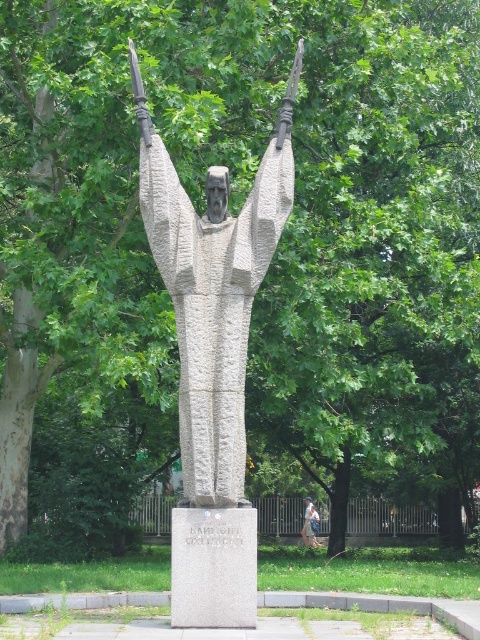
You are a photographer standing in the park. You want to take a photo of the gray stone statue at center and the light blue denim jeans at center. Based on their positions, which object will appear larger in the photo?

The gray stone statue at center will appear larger in the photo because it is closer to the photographer than the light blue denim jeans at center.

In the scene shown: You are a photographer setting up a tripod to capture the gray stone statue at center and the light blue denim jeans at center in the same frame. Based on their sizes, which object should you focus on first to ensure both are in focus?

The gray stone statue at center is bigger than the light blue denim jeans at center, so you should focus on the gray stone statue at center first to ensure both are in focus.